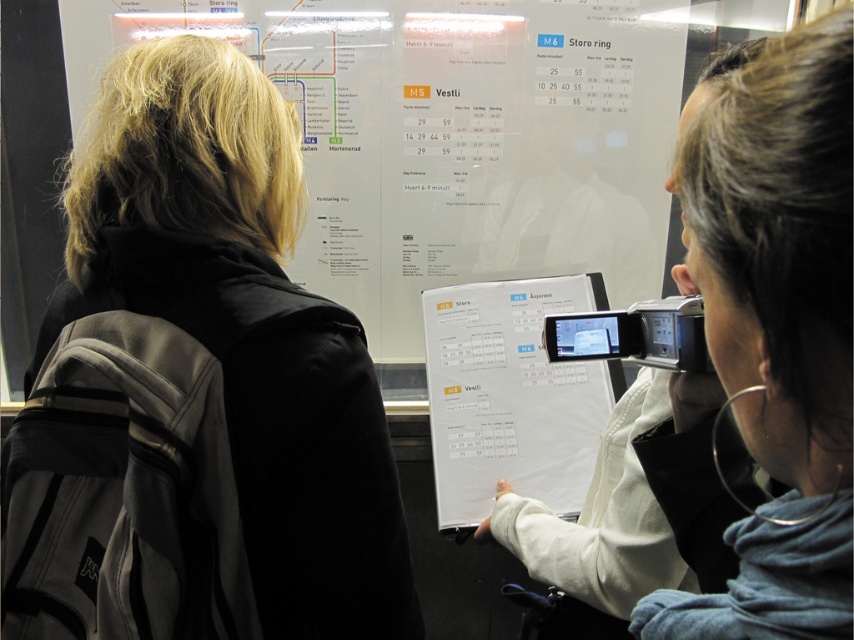
Question: Does dark blue hoodie at upper right come in front of white paper calendar at center?

Choices:
 (A) no
 (B) yes

Answer: (B)

Question: Which is farther from the white paper at center?

Choices:
 (A) dark blue hoodie at upper right
 (B) white paper calendar at center

Answer: (A)

Question: Which of the following is the closest to the observer?

Choices:
 (A) (316, 388)
 (B) (810, 230)
 (C) (483, 369)
 (D) (623, 10)

Answer: (B)

Question: Can you confirm if dark blue hoodie at upper right is positioned above white paper calendar at center?

Choices:
 (A) yes
 (B) no

Answer: (A)

Question: In this image, where is white paper at center located relative to white paper calendar at center?

Choices:
 (A) right
 (B) left

Answer: (B)

Question: Which object is farther from the camera taking this photo?

Choices:
 (A) black fabric jacket at upper left
 (B) white paper at center
 (C) white paper calendar at center

Answer: (B)